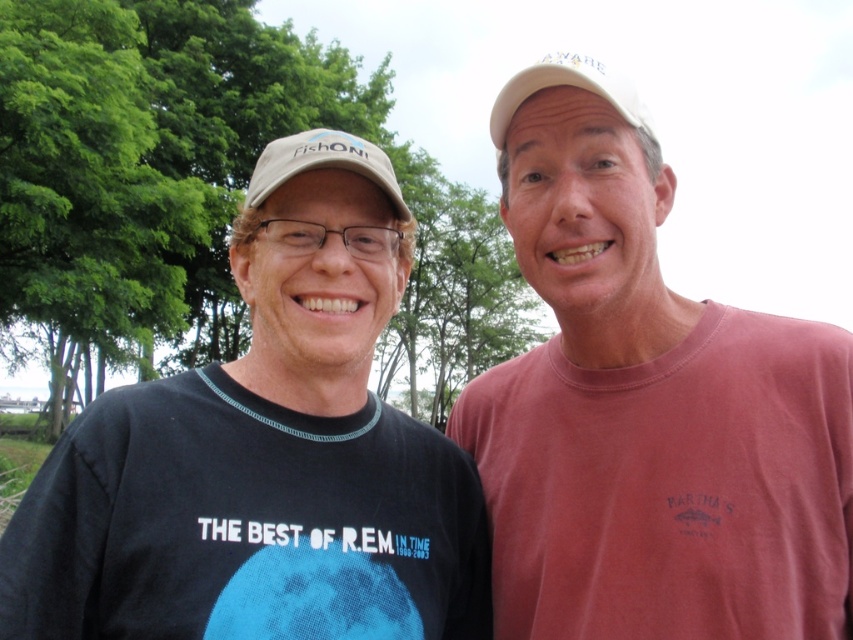
You are a photographer trying to capture both the green leafy tree at upper left and the white fabric baseball cap at upper center in the same frame. Which object should you focus on first to ensure both are in the frame?

The green leafy tree at upper left is taller than the white fabric baseball cap at upper center, so you should focus on the taller green leafy tree at upper left first to ensure both are in the frame.

You are a photographer trying to capture a closeup of the green leafy tree at upper left and the white fabric baseball cap at upper center. Which object should you focus on first to ensure it appears sharp in the photo?

The green leafy tree at upper left is further to the viewer than the white fabric baseball cap at upper center, so you should focus on the green leafy tree at upper left first to ensure it appears sharp in the photo.